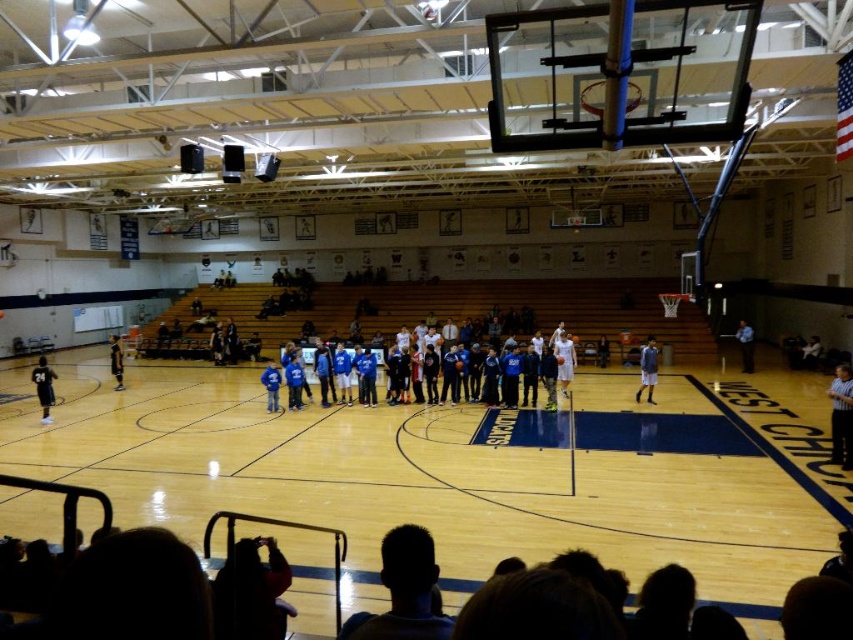
You are a photographer positioned at the center of the court. You need to capture a photo that includes both the gray fabric jacket at lower right and the black jersey at left. Since you want to ensure both are visible, which object should you adjust your camera angle to focus on first to account for their sizes?

The gray fabric jacket at lower right is smaller in width than the black jersey at left. Therefore, to ensure both are visible, you should first focus on the smaller gray fabric jacket at lower right to frame the shot appropriately, then adjust to include the larger black jersey at left.

You are a photographer standing at the edge of the basketball court. You need to take a photo of both the blue jersey at center and the white matte basketball player at center. Based on their positions, which one is closer to the left side of the photo?

The blue jersey at center is to the left of the white matte basketball player at center, so the blue jersey at center will be closer to the left side of the photo.

You are a photographer standing at the edge of the basketball court. You need to capture a photo of the black jersey at left and the black jersey at center so that both are visible in the frame. Based on their positions, which jersey is further to the left in the image?

The black jersey at left is positioned on the left side of the black jersey at center, so the black jersey at left is further to the left in the image.